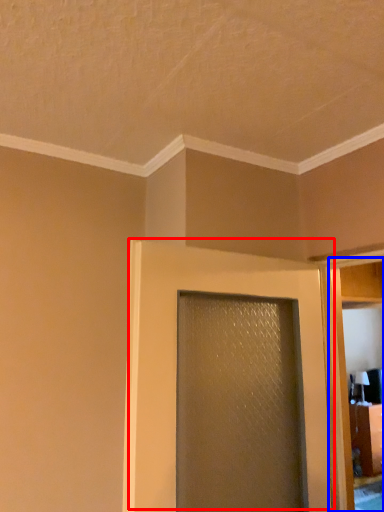
Question: Which object appears farthest to the camera in this image, door (highlighted by a red box) or elevator (highlighted by a blue box)?

Choices:
 (A) door
 (B) elevator

Answer: (B)